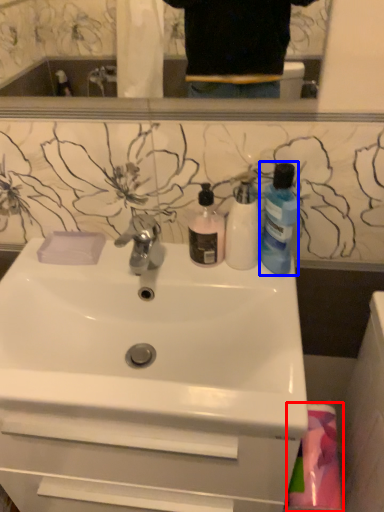
Question: Which object appears closest to the camera in this image, material (highlighted by a red box) or cleaning product (highlighted by a blue box)?

Choices:
 (A) material
 (B) cleaning product

Answer: (B)